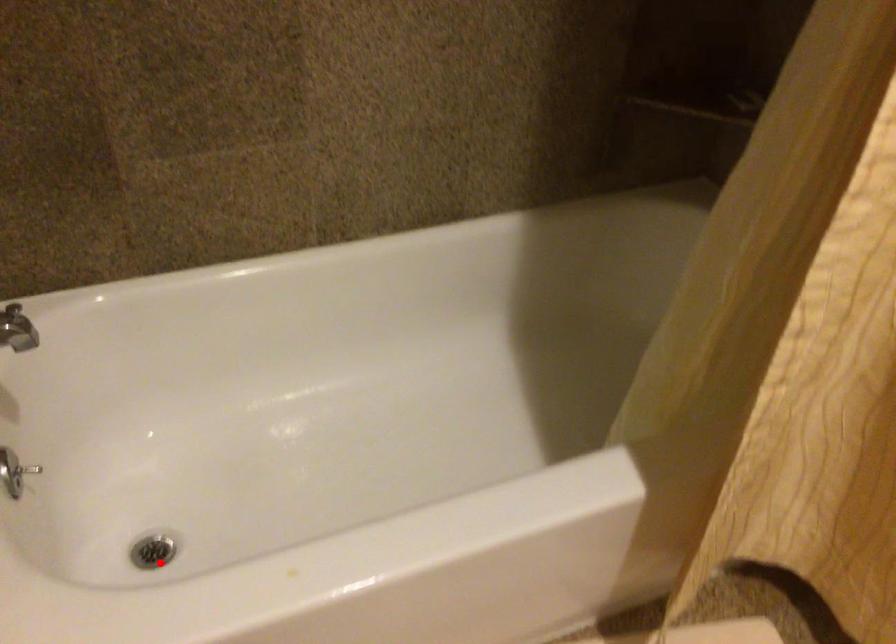
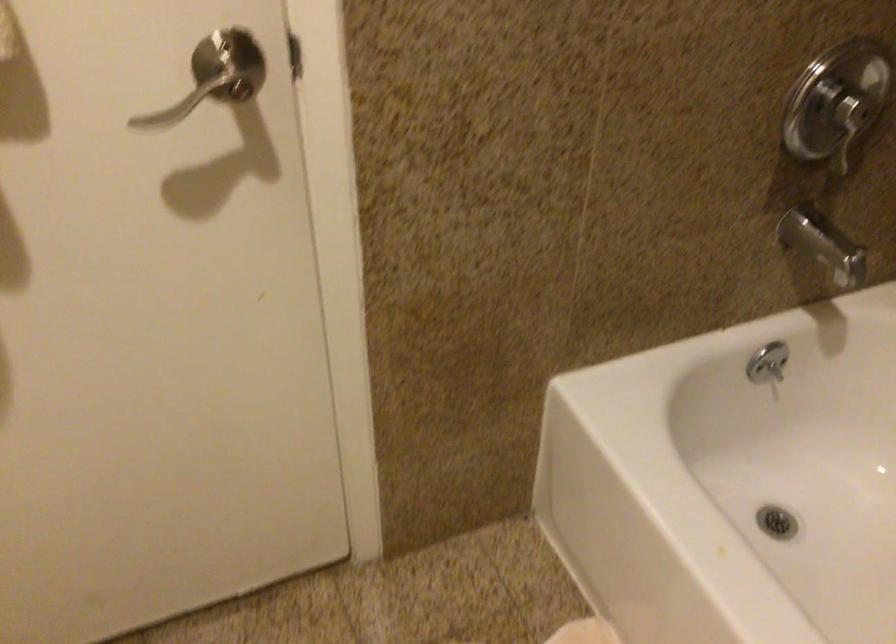
Question: I am providing you with two images of the same scene from different viewpoints. A red point is marked on the first image. Is the red point's position out of view in image 2?

Choices:
 (A) Yes
 (B) No

Answer: (B)